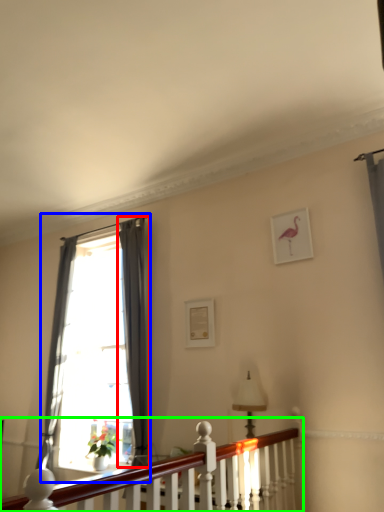
Question: Which is nearer to the curtain (highlighted by a red box)? window (highlighted by a blue box) or balustrade (highlighted by a green box).

Choices:
 (A) window
 (B) balustrade

Answer: (A)